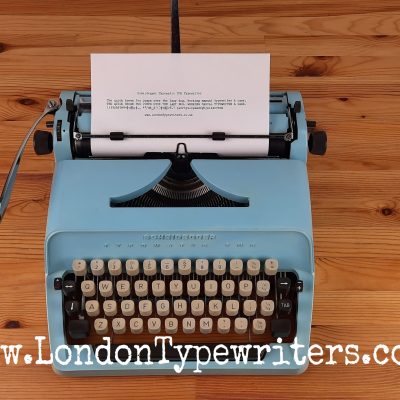
The image size is (400, 400). In order to click on typewriter in this screenshot , I will do `click(82, 179)`.